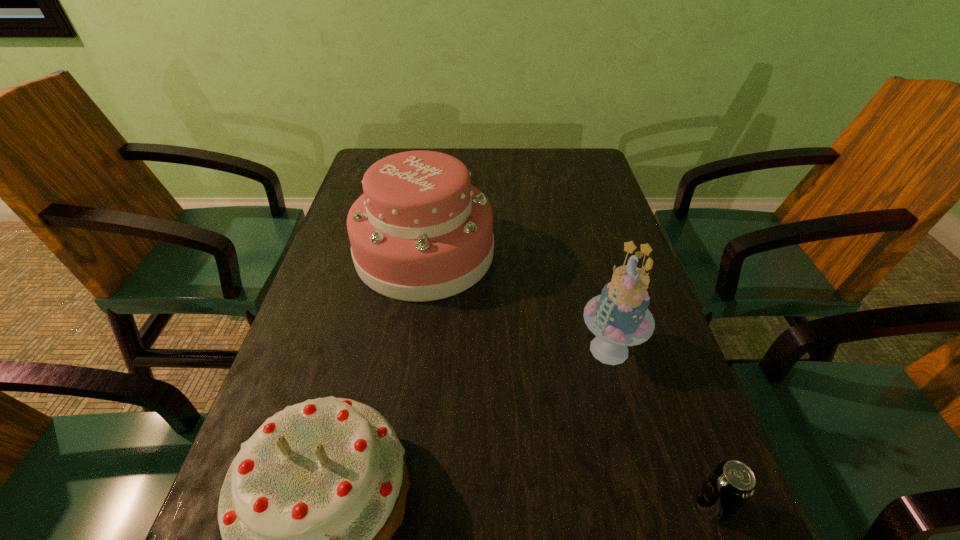
Where is `free area in between the farthest object and the rightmost cake`? The image size is (960, 540). free area in between the farthest object and the rightmost cake is located at coordinates (516, 301).

Select which object appears as the third closest to the rightmost object. Please provide its 2D coordinates. Your answer should be formatted as a tuple, i.e. [(x, y)], where the tuple contains the x and y coordinates of a point satisfying the conditions above.

[(420, 231)]

The width and height of the screenshot is (960, 540). Identify the location of object that can be found as the closest to the farthest cake. (619, 317).

You are a GUI agent. You are given a task and a screenshot of the screen. Output one action in this format:
    pyautogui.click(x=<x>, y=<y>)
    Task: Click on the closest cake relative to the farthest cake
    The height and width of the screenshot is (540, 960).
    Given the screenshot: What is the action you would take?
    pyautogui.click(x=619, y=317)

Locate which cake ranks in proximity to the second farthest object. Please provide its 2D coordinates. Your answer should be formatted as a tuple, i.e. [(x, y)], where the tuple contains the x and y coordinates of a point satisfying the conditions above.

[(420, 231)]

This screenshot has width=960, height=540. Find the location of `free space that satisfies the following two spatial constraints: 1. with a ladder on the side of the second farthest object; 2. on the right side of the shortest object`. free space that satisfies the following two spatial constraints: 1. with a ladder on the side of the second farthest object; 2. on the right side of the shortest object is located at coordinates (651, 506).

This screenshot has width=960, height=540. I want to click on vacant region that satisfies the following two spatial constraints: 1. with a ladder on the side of the soda can; 2. on the left side of the second farthest object, so tap(651, 506).

Find the location of a particular element. The width and height of the screenshot is (960, 540). vacant space that satisfies the following two spatial constraints: 1. on the back side of the soda can; 2. with a ladder on the side of the second nearest cake is located at coordinates click(x=656, y=349).

Identify the location of free location that satisfies the following two spatial constraints: 1. with a ladder on the side of the rightmost cake; 2. on the right side of the soda can. point(651,506).

Identify the location of free space that satisfies the following two spatial constraints: 1. on the front side of the shortest object; 2. on the right side of the farthest cake. [389, 506].